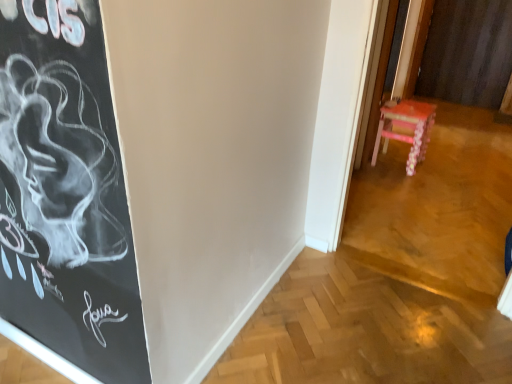
The width and height of the screenshot is (512, 384). Describe the element at coordinates (406, 129) in the screenshot. I see `pink wood stool at right` at that location.

Where is `pink wood stool at right`? This screenshot has width=512, height=384. pink wood stool at right is located at coordinates (406, 129).

The height and width of the screenshot is (384, 512). In order to click on pink wood stool at right in this screenshot , I will do `click(406, 129)`.